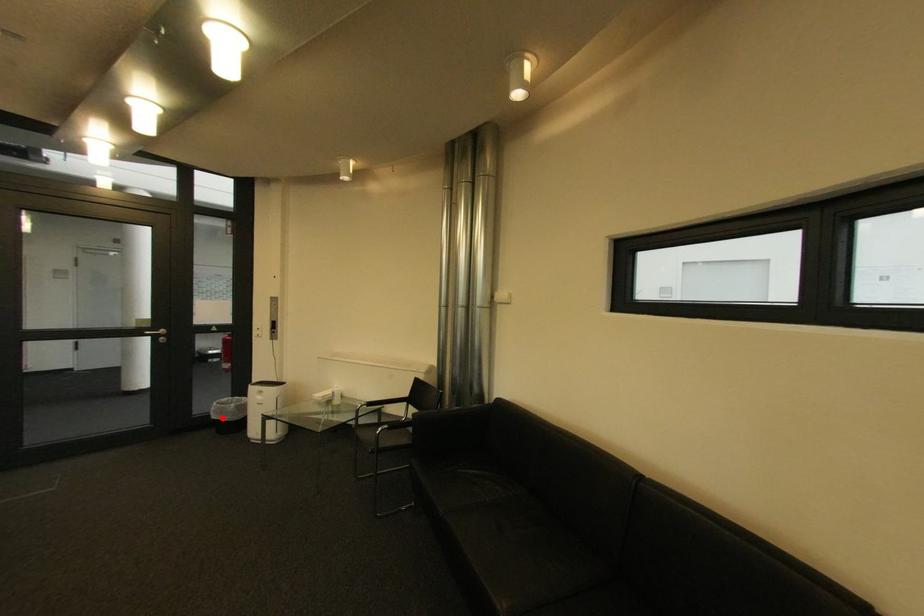
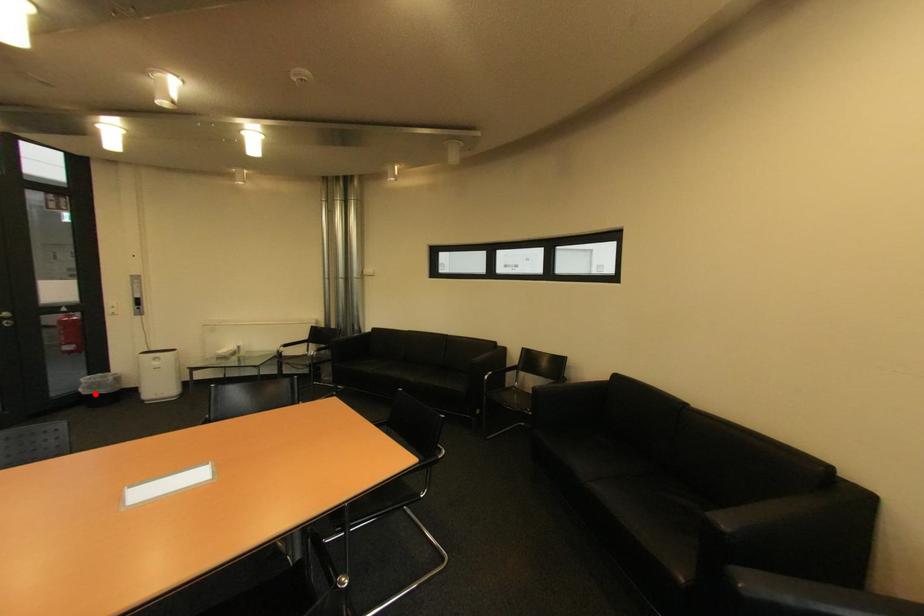
I am providing you with two images of the same scene from different viewpoints. A red point is marked on the first image and another point is marked on the second image. Is the marked point in image1 the same physical position as the marked point in image2?

Yes